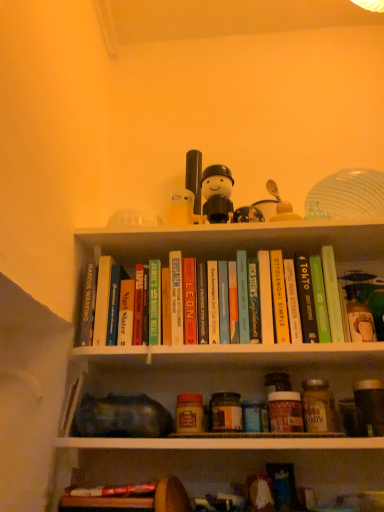
At what (x,y) coordinates should I click in order to perform the action: click on hardcover book at upper center, the 4th paperback book in the right-to-left sequence. Please return your answer as a coordinate pair (x, y). Image resolution: width=384 pixels, height=512 pixels. Looking at the image, I should click on (292, 302).

Image resolution: width=384 pixels, height=512 pixels. Describe the element at coordinates (243, 296) in the screenshot. I see `teal matte book at center, positioned as the seventh paperback book in right-to-left order` at that location.

Locate an element on the screen. This screenshot has width=384, height=512. teal matte book at center, positioned as the seventh paperback book in right-to-left order is located at coordinates (243, 296).

Measure the distance between green matte book at upper center, the first paperback book positioned from the right, and camera.

The distance of green matte book at upper center, the first paperback book positioned from the right, from camera is 3.45 feet.

How much space does hardcover book at center, which ranks as the ninth paperback book in right-to-left order, occupy vertically?

It is 11.16 inches.

Where is `hardcover book at upper center, which ranks as the eighth paperback book in left-to-right order`? This screenshot has height=512, width=384. hardcover book at upper center, which ranks as the eighth paperback book in left-to-right order is located at coordinates (306, 298).

From their relative heights in the image, would you say hardcover book at upper center, the third paperback book when ordered from right to left, is taller or shorter than green matte toy at upper right, arranged as the 1th toy when ordered from the bottom?

Clearly, hardcover book at upper center, the third paperback book when ordered from right to left, is taller compared to green matte toy at upper right, arranged as the 1th toy when ordered from the bottom.

Is hardcover book at upper center, the third paperback book when ordered from right to left, looking in the opposite direction of green matte toy at upper right, which ranks as the 1th toy in front-to-back order?

No, green matte toy at upper right, which ranks as the 1th toy in front-to-back order, is not at the back of hardcover book at upper center, the third paperback book when ordered from right to left.

From a real-world perspective, is hardcover book at upper center, which ranks as the eighth paperback book in left-to-right order, beneath green matte toy at upper right, which ranks as the 1th toy in front-to-back order?

No, from a real-world perspective, hardcover book at upper center, which ranks as the eighth paperback book in left-to-right order, is not below green matte toy at upper right, which ranks as the 1th toy in front-to-back order.

Which point is more distant from viewer, [300,271] or [366,335]?

The point [300,271] is more distant.

In terms of height, does hardcover book at upper center, the third paperback book when ordered from right to left, look taller or shorter compared to green matte book at upper right, which appears as the 2th paperback book when viewed from the right?

hardcover book at upper center, the third paperback book when ordered from right to left, is taller than green matte book at upper right, which appears as the 2th paperback book when viewed from the right.

From the image's perspective, which object appears higher, hardcover book at upper center, the third paperback book when ordered from right to left, or green matte book at upper right, which appears as the 2th paperback book when viewed from the right?

hardcover book at upper center, the third paperback book when ordered from right to left, is shown above in the image.

At what (x,y) coordinates should I click in order to perform the action: click on paperback book that is the 3rd object located in front of the green matte book at upper right, which appears as the 2th paperback book when viewed from the right. Please return your answer as a coordinate pair (x, y). The height and width of the screenshot is (512, 384). Looking at the image, I should click on (306, 298).

Is green matte book at upper center, the first paperback book positioned from the right, turned away from hardcover book at center, which ranks as the ninth paperback book in right-to-left order?

green matte book at upper center, the first paperback book positioned from the right, does not have its back to hardcover book at center, which ranks as the ninth paperback book in right-to-left order.

Could you measure the distance between green matte book at upper center, marked as the 10th paperback book in a left-to-right arrangement, and hardcover book at center, marked as the second paperback book in a left-to-right arrangement?

green matte book at upper center, marked as the 10th paperback book in a left-to-right arrangement, and hardcover book at center, marked as the second paperback book in a left-to-right arrangement, are 39.45 centimeters apart.

Based on the photo, considering the sizes of objects green matte book at upper center, marked as the 10th paperback book in a left-to-right arrangement, and hardcover book at center, marked as the second paperback book in a left-to-right arrangement, in the image provided, who is thinner, green matte book at upper center, marked as the 10th paperback book in a left-to-right arrangement, or hardcover book at center, marked as the second paperback book in a left-to-right arrangement,?

green matte book at upper center, marked as the 10th paperback book in a left-to-right arrangement.

Which is correct: hardcover book at center, the 10th paperback book positioned from the right, is inside hardcover book at center, which is the third paperback book in left-to-right order, or outside of it?

hardcover book at center, the 10th paperback book positioned from the right, is outside hardcover book at center, which is the third paperback book in left-to-right order.

Is hardcover book at center, acting as the first paperback book starting from the left, shorter than hardcover book at center, arranged as the 8th paperback book when viewed from the right?

No.

Is hardcover book at center, which is the third paperback book in left-to-right order, at the back of hardcover book at center, acting as the first paperback book starting from the left?

No, hardcover book at center, acting as the first paperback book starting from the left, is not facing the opposite direction of hardcover book at center, which is the third paperback book in left-to-right order.

Considering the sizes of objects hardcover book at center, the 10th paperback book positioned from the right, and hardcover book at center, arranged as the 8th paperback book when viewed from the right, in the image provided, who is wider, hardcover book at center, the 10th paperback book positioned from the right, or hardcover book at center, arranged as the 8th paperback book when viewed from the right,?

With larger width is hardcover book at center, the 10th paperback book positioned from the right.

Are green matte toy at upper right, which ranks as the 1th toy in front-to-back order, and hardcover book at upper center, the 4th paperback book in the right-to-left sequence, far apart?

That's not correct — green matte toy at upper right, which ranks as the 1th toy in front-to-back order, is a little close to hardcover book at upper center, the 4th paperback book in the right-to-left sequence.

Is green matte toy at upper right, the second toy viewed from the left, looking in the opposite direction of hardcover book at upper center, positioned as the 7th paperback book in left-to-right order?

green matte toy at upper right, the second toy viewed from the left, does not have its back to hardcover book at upper center, positioned as the 7th paperback book in left-to-right order.

From a real-world perspective, is green matte toy at upper right, which ranks as the 1th toy in front-to-back order, on hardcover book at upper center, positioned as the 7th paperback book in left-to-right order?

No.

Find the location of a particular element. The width and height of the screenshot is (384, 512). toy beneath the hardcover book at upper center, the 4th paperback book in the right-to-left sequence (from a real-world perspective) is located at coordinates (363, 305).

From a real-world perspective, is hardcover book at center, the 5th paperback book viewed from the left, below green matte book at upper center, marked as the 10th paperback book in a left-to-right arrangement?

Indeed, from a real-world perspective, hardcover book at center, the 5th paperback book viewed from the left, is positioned beneath green matte book at upper center, marked as the 10th paperback book in a left-to-right arrangement.

Based on their sizes in the image, would you say hardcover book at center, which appears as the 6th paperback book when viewed from the right, is bigger or smaller than green matte book at upper center, marked as the 10th paperback book in a left-to-right arrangement?

Clearly, hardcover book at center, which appears as the 6th paperback book when viewed from the right, is smaller in size than green matte book at upper center, marked as the 10th paperback book in a left-to-right arrangement.

Is the depth of hardcover book at center, which appears as the 6th paperback book when viewed from the right, greater than that of green matte book at upper center, marked as the 10th paperback book in a left-to-right arrangement?

That is True.

Is hardcover book at center, the 5th paperback book viewed from the left, turned away from green matte book at upper center, marked as the 10th paperback book in a left-to-right arrangement?

No, hardcover book at center, the 5th paperback book viewed from the left, is not facing the opposite direction of green matte book at upper center, marked as the 10th paperback book in a left-to-right arrangement.

Consider the image. From the image's perspective, is hardcover book at center, the 10th paperback book positioned from the right, above hardcover book at upper center, the third paperback book when ordered from right to left?

Actually, hardcover book at center, the 10th paperback book positioned from the right, appears below hardcover book at upper center, the third paperback book when ordered from right to left, in the image.

Is hardcover book at center, the 10th paperback book positioned from the right, not close to hardcover book at upper center, the third paperback book when ordered from right to left?

No.

From a real-world perspective, is hardcover book at center, the 10th paperback book positioned from the right, positioned under hardcover book at upper center, which ranks as the eighth paperback book in left-to-right order, based on gravity?

No.

Can you confirm if hardcover book at center, acting as the first paperback book starting from the left, is taller than hardcover book at upper center, which ranks as the eighth paperback book in left-to-right order?

Indeed, hardcover book at center, acting as the first paperback book starting from the left, has a greater height compared to hardcover book at upper center, which ranks as the eighth paperback book in left-to-right order.

Identify the location of the 9th paperback book in front of the green matte toy at upper right, the second toy when ordered from top to bottom. This screenshot has height=512, width=384. (306, 298).

The width and height of the screenshot is (384, 512). There is a green matte book at upper right, which is the 9th paperback book in left-to-right order. In order to click on the 3rd paperback book above it (from a real-world perspective) in this screenshot , I will do `click(306, 298)`.

Based on their spatial positions, is hardcover book at center, acting as the first paperback book starting from the left, or green matte book at upper right, which appears as the 2th paperback book when viewed from the right, closer to hardcover book at upper center, which ranks as the eighth paperback book in left-to-right order?

green matte book at upper right, which appears as the 2th paperback book when viewed from the right, lies closer to hardcover book at upper center, which ranks as the eighth paperback book in left-to-right order, than the other object.

Which object lies nearer to the anchor point white plastic toy at upper center, acting as the 2th toy starting from the front, hardcover book at center, the 10th paperback book positioned from the right, or white matte figurine at upper center?

white matte figurine at upper center is closer to white plastic toy at upper center, acting as the 2th toy starting from the front.

Which object lies nearer to the anchor point green matte book at upper right, which is the 9th paperback book in left-to-right order, hardcover book at center, arranged as the fifth paperback book when viewed from the right, or hardcover book at center, the 10th paperback book positioned from the right?

Based on the image, hardcover book at center, arranged as the fifth paperback book when viewed from the right, appears to be nearer to green matte book at upper right, which is the 9th paperback book in left-to-right order.

When comparing their distances from hardcover book at upper center, positioned as the 7th paperback book in left-to-right order, does green matte book at upper center, marked as the 10th paperback book in a left-to-right arrangement, or green matte toy at upper right, the second toy when ordered from top to bottom, seem further?

Among the two, green matte toy at upper right, the second toy when ordered from top to bottom, is located further to hardcover book at upper center, positioned as the 7th paperback book in left-to-right order.

Estimate the real-world distances between objects in this image. Which object is closer to hardcover book at upper center, the third paperback book when ordered from right to left, hardcover book at center, which is the 6th paperback book from left to right, or teal matte book at center, positioned as the seventh paperback book in right-to-left order?

hardcover book at center, which is the 6th paperback book from left to right, lies closer to hardcover book at upper center, the third paperback book when ordered from right to left, than the other object.

Which object lies nearer to the anchor point hardcover book at center, which ranks as the ninth paperback book in right-to-left order, hardcover book at upper center, the 4th paperback book in the right-to-left sequence, or white matte figurine at upper center?

Among the two, white matte figurine at upper center is located nearer to hardcover book at center, which ranks as the ninth paperback book in right-to-left order.

Looking at the image, which one is located further to hardcover book at center, arranged as the fifth paperback book when viewed from the right, green matte toy at upper right, which ranks as the 1th toy in front-to-back order, or teal matte book at center, positioned as the seventh paperback book in right-to-left order?

Among the two, green matte toy at upper right, which ranks as the 1th toy in front-to-back order, is located further to hardcover book at center, arranged as the fifth paperback book when viewed from the right.

Considering their positions, is hardcover book at upper center, positioned as the 7th paperback book in left-to-right order, positioned closer to hardcover book at center, which is the 6th paperback book from left to right, than hardcover book at center, the 10th paperback book positioned from the right?

hardcover book at upper center, positioned as the 7th paperback book in left-to-right order, is positioned closer to the anchor hardcover book at center, which is the 6th paperback book from left to right.

Identify the location of figurine between hardcover book at center, acting as the first paperback book starting from the left, and green matte book at upper center, the first paperback book positioned from the right. (217, 193).

Locate an element on the screen. paperback book between hardcover book at center, which is the 6th paperback book from left to right, and hardcover book at upper center, which ranks as the eighth paperback book in left-to-right order is located at coordinates (292, 302).

The image size is (384, 512). I want to click on toy between hardcover book at center, the 10th paperback book positioned from the right, and hardcover book at upper center, which ranks as the eighth paperback book in left-to-right order, so click(x=183, y=209).

Where is `toy between hardcover book at center, marked as the second paperback book in a left-to-right arrangement, and green matte book at upper right, which appears as the 2th paperback book when viewed from the right`? The width and height of the screenshot is (384, 512). toy between hardcover book at center, marked as the second paperback book in a left-to-right arrangement, and green matte book at upper right, which appears as the 2th paperback book when viewed from the right is located at coordinates (183, 209).